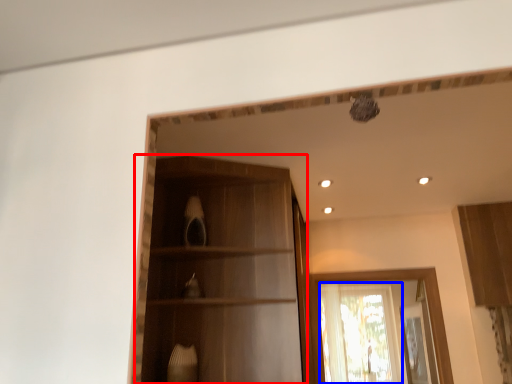
Question: Which of the following is the farthest to the observer, cabinetry (highlighted by a red box) or window (highlighted by a blue box)?

Choices:
 (A) cabinetry
 (B) window

Answer: (B)